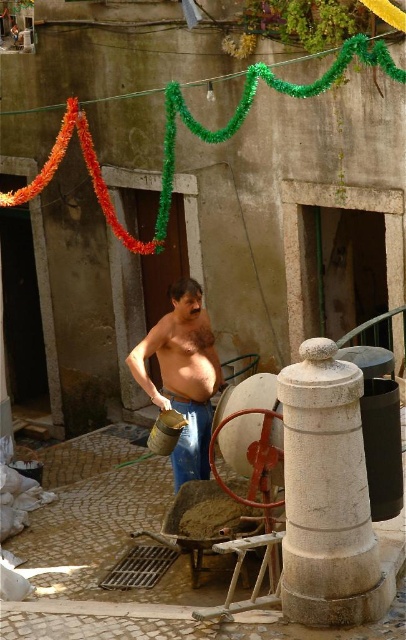
Question: Which of the following is the closest to the observer?

Choices:
 (A) (349, 499)
 (B) (168, 396)

Answer: (A)

Question: Does white stone pillar at center appear on the left side of blue denim jeans at center?

Choices:
 (A) yes
 (B) no

Answer: (B)

Question: Which point is farther to the camera?

Choices:
 (A) white stone pillar at center
 (B) shiny metallic bucket at center

Answer: (B)

Question: Considering the real-world distances, which object is farthest from the white stone pillar at center?

Choices:
 (A) shiny metallic bucket at center
 (B) blue denim jeans at center

Answer: (A)

Question: Does white stone pillar at center appear on the left side of blue denim jeans at center?

Choices:
 (A) yes
 (B) no

Answer: (B)

Question: Is white stone pillar at center positioned at the back of shiny metallic bucket at center?

Choices:
 (A) yes
 (B) no

Answer: (B)